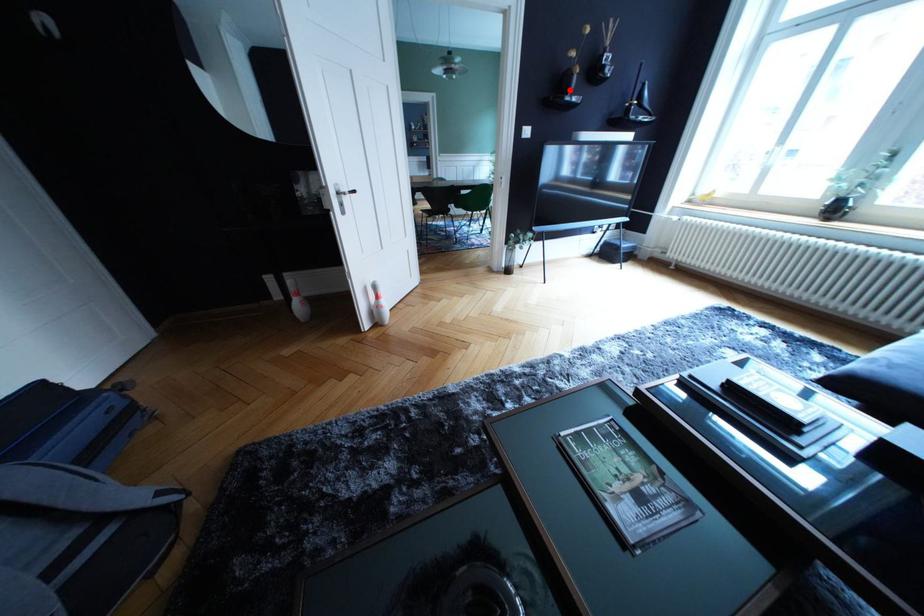
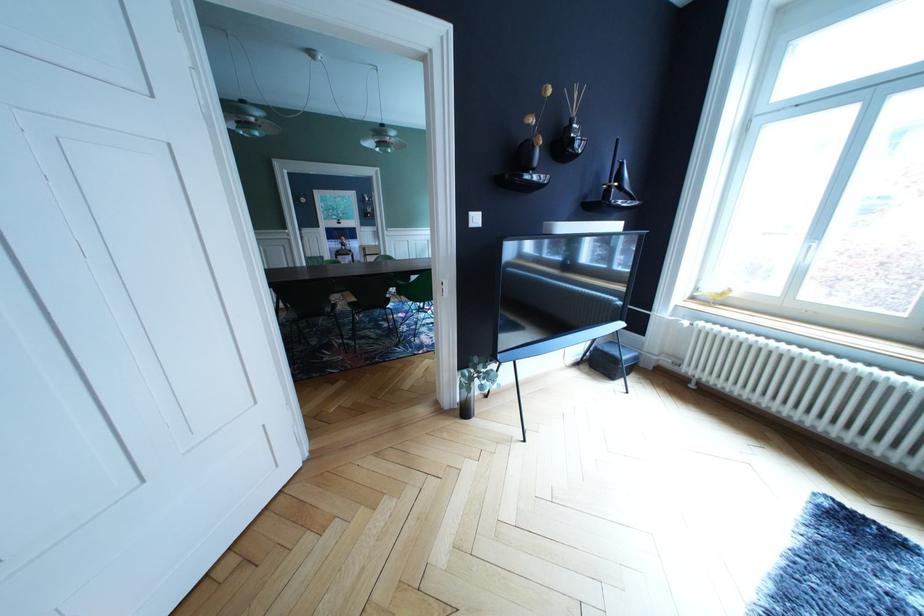
In the second image, find the point that corresponds to the highlighted location in the first image.

(529, 164)